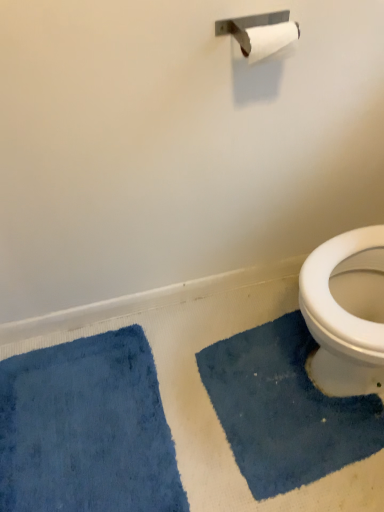
Where is `free space below blue plush bath mat at lower left, placed as the 1th bath mat when sorted from left to right (from a real-world perspective)`? Image resolution: width=384 pixels, height=512 pixels. free space below blue plush bath mat at lower left, placed as the 1th bath mat when sorted from left to right (from a real-world perspective) is located at coordinates (91, 432).